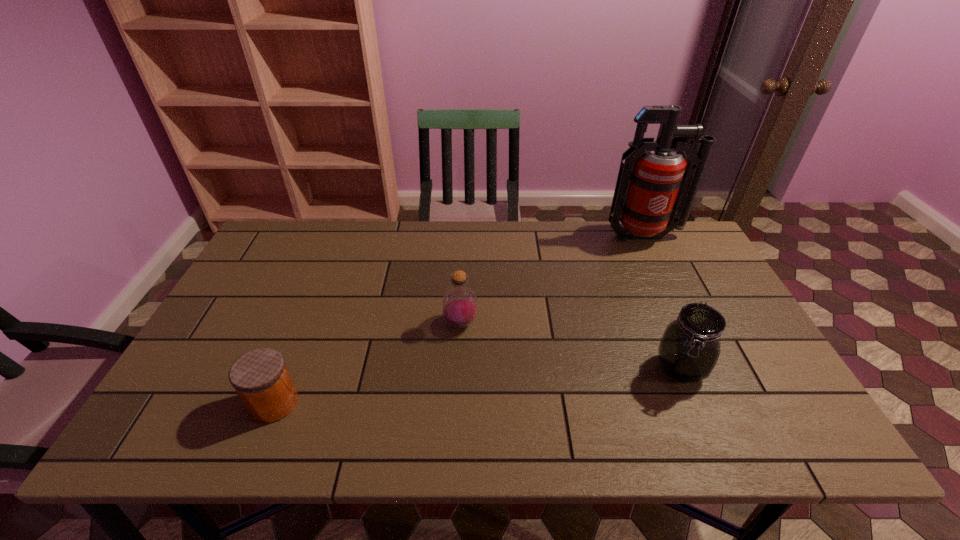
Locate an element on the screen. Image resolution: width=960 pixels, height=540 pixels. vacant point located between the third nearest object and the leftmost object is located at coordinates (368, 363).

Locate which object ranks third in proximity to the right jar. Please provide its 2D coordinates. Your answer should be formatted as a tuple, i.e. [(x, y)], where the tuple contains the x and y coordinates of a point satisfying the conditions above.

[(260, 377)]

Select which object appears as the third closest to the taller jar. Please provide its 2D coordinates. Your answer should be formatted as a tuple, i.e. [(x, y)], where the tuple contains the x and y coordinates of a point satisfying the conditions above.

[(260, 377)]